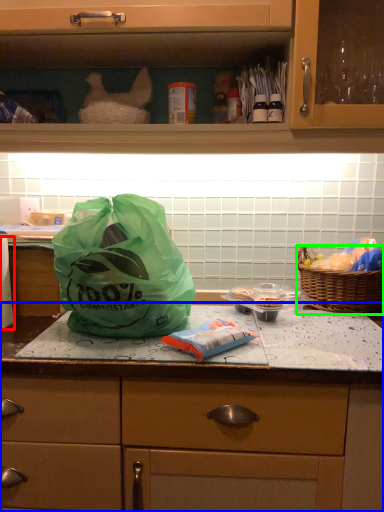
Question: Which object is the farthest from toilet paper (highlighted by a red box)? Choose among these: countertop (highlighted by a blue box) or picnic basket (highlighted by a green box).

Choices:
 (A) countertop
 (B) picnic basket

Answer: (B)